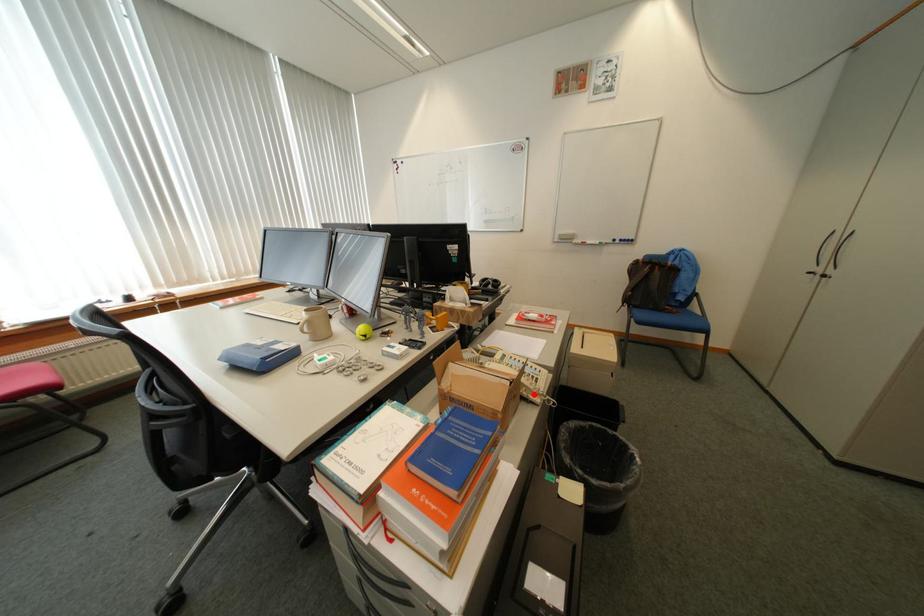
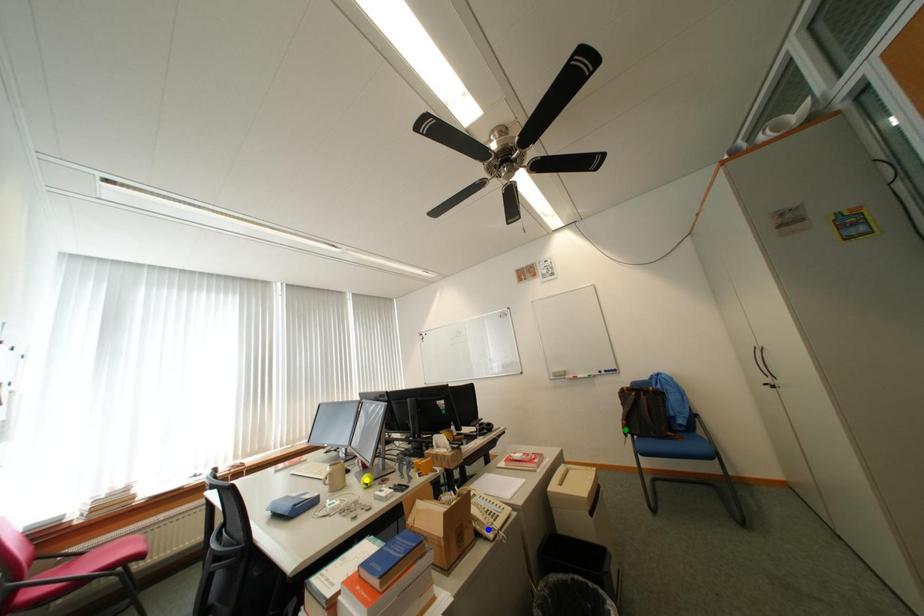
Question: I am providing you with two images of the same scene from different viewpoints. A red point is marked on the first image. You are given multiple points on the second image. Can you choose the point in image 2 that corresponds to the point in image 1?

Choices:
 (A) yellow point
 (B) green point
 (C) blue point

Answer: (C)